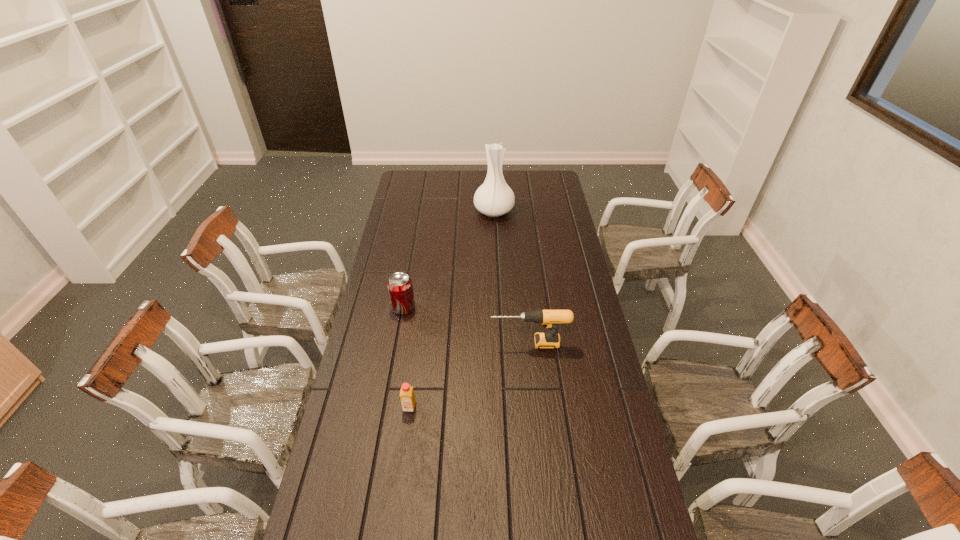
The width and height of the screenshot is (960, 540). What are the coordinates of `free space located 0.210m on the handle side of the drill` in the screenshot? It's located at (433, 343).

What are the coordinates of `free region located on the back of the third nearest object` in the screenshot? It's located at (414, 248).

Find the location of a particular element. The image size is (960, 540). vacant space located on the front and back of the shortest object is located at coordinates (400, 475).

Locate an element on the screen. The image size is (960, 540). object that is at the left edge is located at coordinates (400, 288).

Find the location of `object that is positioned at the right edge`. object that is positioned at the right edge is located at coordinates (549, 318).

This screenshot has width=960, height=540. I want to click on vacant space at the left edge of the desktop, so click(x=364, y=428).

You are a GUI agent. You are given a task and a screenshot of the screen. Output one action in this format:
    pyautogui.click(x=<x>, y=<y>)
    Task: Click on the vacant region at the right edge of the desktop
    This screenshot has height=540, width=960.
    Given the screenshot: What is the action you would take?
    pyautogui.click(x=585, y=383)

Locate an element on the screen. free region at the far left corner is located at coordinates (404, 175).

Image resolution: width=960 pixels, height=540 pixels. Identify the location of unoccupied position between the drill and the tallest object. (512, 277).

I want to click on free space that is in between the farthest object and the orange juice, so click(451, 309).